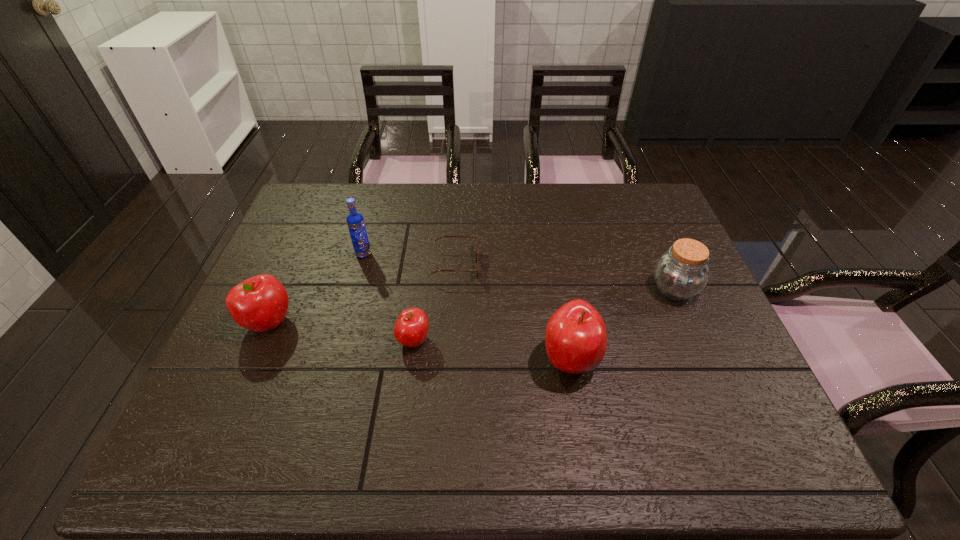
In order to click on the second tallest apple in this screenshot , I will do `click(260, 303)`.

The width and height of the screenshot is (960, 540). What are the coordinates of `the leftmost apple` in the screenshot? It's located at (260, 303).

Identify the location of the second apple from right to left. This screenshot has width=960, height=540. (411, 328).

Identify the location of the fifth tallest object. The width and height of the screenshot is (960, 540). (411, 328).

Where is `the fifth object from left to right`? the fifth object from left to right is located at coordinates (575, 338).

You are a GUI agent. You are given a task and a screenshot of the screen. Output one action in this format:
    pyautogui.click(x=<x>, y=<y>)
    Task: Click on the vodka
    Image resolution: width=960 pixels, height=540 pixels.
    Given the screenshot: What is the action you would take?
    pyautogui.click(x=355, y=221)

Find the location of `the rightmost object`. the rightmost object is located at coordinates (680, 273).

I want to click on the shortest object, so click(x=442, y=236).

Identify the location of free spot located 0.190m on the right of the leftmost apple. This screenshot has height=540, width=960. point(369,322).

At what (x,y) coordinates should I click in order to perform the action: click on vacant region located 0.150m on the left of the shortest apple. Please return your answer as a coordinate pair (x, y). Image resolution: width=960 pixels, height=540 pixels. Looking at the image, I should click on (336, 340).